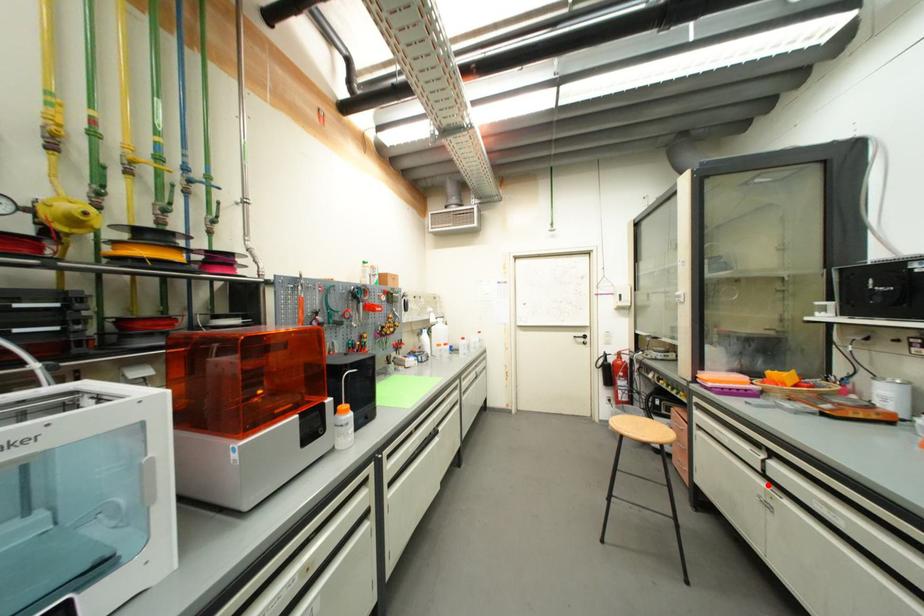
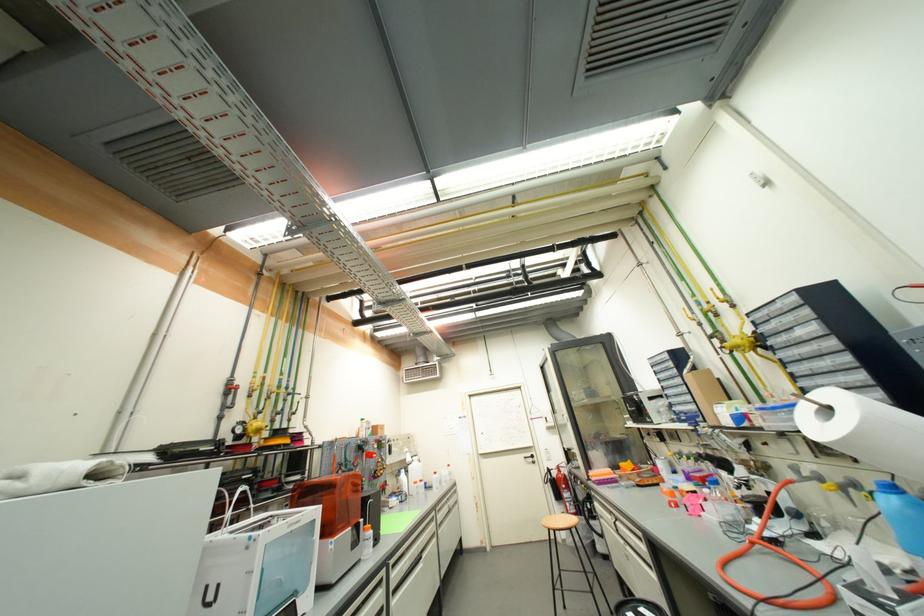
The point at the highlighted location is marked in the first image. Where is the corresponding point in the second image?

(627, 543)